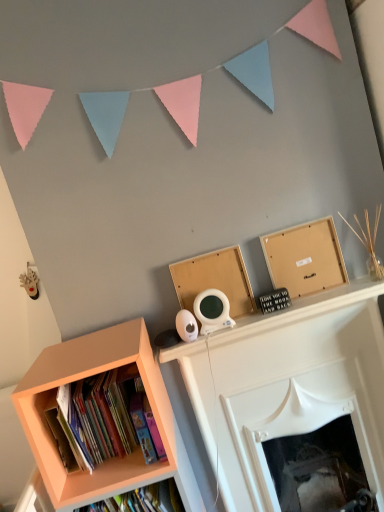
What do you see at coordinates (114, 458) in the screenshot?
I see `matte orange bookcase at lower left` at bounding box center [114, 458].

Measure the distance between matte orange bookshelf at lower left and camera.

matte orange bookshelf at lower left and camera are 1.21 meters apart.

Find the location of a particular element. The height and width of the screenshot is (512, 384). white glossy fireplace at upper center is located at coordinates point(288,386).

Locate an element on the screen. The height and width of the screenshot is (512, 384). wooden frame at upper right is located at coordinates (305, 258).

How much distance is there between matte orange bookcase at lower left and matte orange bookshelf at lower left?

matte orange bookcase at lower left and matte orange bookshelf at lower left are 4.08 inches apart.

From a real-world perspective, is matte orange bookcase at lower left positioned under matte orange bookshelf at lower left based on gravity?

Yes, from a real-world perspective, matte orange bookcase at lower left is under matte orange bookshelf at lower left.

Considering the positions of objects matte orange bookcase at lower left and matte orange bookshelf at lower left in the image provided, who is more to the right, matte orange bookcase at lower left or matte orange bookshelf at lower left?

From the viewer's perspective, matte orange bookcase at lower left appears more on the right side.

Is matte orange bookcase at lower left positioned far away from matte orange bookshelf at lower left?

matte orange bookcase at lower left is near matte orange bookshelf at lower left, not far away.

Would you say matte orange bookshelf at lower left is inside or outside matte orange bookcase at lower left?

matte orange bookshelf at lower left is enclosed within matte orange bookcase at lower left.

How far apart are matte orange bookshelf at lower left and matte orange bookcase at lower left?

The distance of matte orange bookshelf at lower left from matte orange bookcase at lower left is 4.08 inches.

Is the surface of matte orange bookshelf at lower left in direct contact with matte orange bookcase at lower left?

No.

Find the location of a particular element. The height and width of the screenshot is (512, 384). bookcase in front of the matte orange bookshelf at lower left is located at coordinates click(x=114, y=458).

From the image's perspective, is matte orange bookcase at lower left below pastel paper flags at upper center?

Correct, matte orange bookcase at lower left appears lower than pastel paper flags at upper center in the image.

Find the location of a particular element. Image resolution: width=384 pixels, height=512 pixels. backdrop above the matte orange bookcase at lower left (from a real-world perspective) is located at coordinates click(x=177, y=148).

Which of these two, matte orange bookcase at lower left or pastel paper flags at upper center, stands shorter?

pastel paper flags at upper center is shorter.

How distant is matte orange bookcase at lower left from pastel paper flags at upper center?

matte orange bookcase at lower left and pastel paper flags at upper center are 54.93 centimeters apart from each other.

Can you tell me how much white glossy fireplace at upper center and matte orange bookshelf at lower left differ in facing direction?

The angular difference between white glossy fireplace at upper center and matte orange bookshelf at lower left is 0.917 degrees.

Which is in front, point (300, 419) or point (127, 382)?

Point (127, 382)

Is white glossy fireplace at upper center positioned behind matte orange bookshelf at lower left?

Yes, white glossy fireplace at upper center is behind matte orange bookshelf at lower left.

Which of these two, white glossy fireplace at upper center or matte orange bookshelf at lower left, is bigger?

With larger size is white glossy fireplace at upper center.

Is matte orange bookshelf at lower left positioned behind bare wood board at upper center?

No, matte orange bookshelf at lower left is closer to the viewer.

Looking at this image, would you say matte orange bookshelf at lower left is inside or outside bare wood board at upper center?

matte orange bookshelf at lower left is spatially situated outside bare wood board at upper center.

Considering the sizes of objects matte orange bookshelf at lower left and bare wood board at upper center in the image provided, who is smaller, matte orange bookshelf at lower left or bare wood board at upper center?

Smaller between the two is bare wood board at upper center.

From a real-world perspective, is matte orange bookshelf at lower left under bare wood board at upper center?

Yes, from a real-world perspective, matte orange bookshelf at lower left is below bare wood board at upper center.

Does white glossy fireplace at upper center have a lesser width compared to pastel paper flags at upper center?

No.

From the picture: From a real-world perspective, does white glossy fireplace at upper center sit lower than pastel paper flags at upper center?

Correct, in the physical world, white glossy fireplace at upper center is lower than pastel paper flags at upper center.

Considering the points (363, 438) and (61, 322), which point is in front, point (363, 438) or point (61, 322)?

The point (61, 322) is in front.

Is the depth of white glossy fireplace at upper center greater than that of pastel paper flags at upper center?

Yes, white glossy fireplace at upper center is further from the viewer.

From a real-world perspective, is wooden frame at upper right located beneath white glossy fireplace at upper center?

Incorrect, from a real-world perspective, wooden frame at upper right is higher than white glossy fireplace at upper center.

Which is behind, wooden frame at upper right or white glossy fireplace at upper center?

wooden frame at upper right.

Does wooden frame at upper right appear on the right side of white glossy fireplace at upper center?

No.

Does wooden frame at upper right have a lesser width compared to white glossy fireplace at upper center?

A: Yes.

At what (x,y) coordinates should I click in order to perform the action: click on bookcase that is on the right side of matte orange bookshelf at lower left. Please return your answer as a coordinate pair (x, y). The image size is (384, 512). Looking at the image, I should click on (114, 458).

The width and height of the screenshot is (384, 512). Find the location of `book located on the left of matte orange bookcase at lower left`. book located on the left of matte orange bookcase at lower left is located at coordinates (94, 421).

Which object lies further to the anchor point matte orange bookshelf at lower left, matte orange bookcase at lower left or white glossy fireplace at upper center?

Based on the image, white glossy fireplace at upper center appears to be further to matte orange bookshelf at lower left.

Which object lies nearer to the anchor point wooden frame at upper right, pastel paper flags at upper center or matte orange bookcase at lower left?

pastel paper flags at upper center is closer to wooden frame at upper right.

Looking at the image, which one is located closer to white glossy fireplace at upper center, bare wood board at upper center or matte orange bookshelf at lower left?

The object closer to white glossy fireplace at upper center is bare wood board at upper center.

From the image, which object appears to be farther from pastel paper flags at upper center, matte orange bookcase at lower left or matte orange bookshelf at lower left?

matte orange bookshelf at lower left.

When comparing their distances from wooden frame at upper right, does pastel paper flags at upper center or white glossy fireplace at upper center seem further?

Among the two, pastel paper flags at upper center is located further to wooden frame at upper right.

From the picture: Based on their spatial positions, is bare wood board at upper center or white glossy fireplace at upper center further from pastel paper flags at upper center?

white glossy fireplace at upper center lies further to pastel paper flags at upper center than the other object.

Considering their positions, is white glossy fireplace at upper center positioned closer to matte orange bookcase at lower left than bare wood board at upper center?

white glossy fireplace at upper center is positioned closer to the anchor matte orange bookcase at lower left.

Considering their positions, is white glossy fireplace at upper center positioned closer to matte orange bookcase at lower left than wooden frame at upper right?

white glossy fireplace at upper center lies closer to matte orange bookcase at lower left than the other object.

You are a GUI agent. You are given a task and a screenshot of the screen. Output one action in this format:
    pyautogui.click(x=<x>, y=<y>)
    Task: Click on the cardboard box that lies between pastel paper flags at upper center and white glossy fireplace at upper center from top to bottom
    
    Given the screenshot: What is the action you would take?
    pyautogui.click(x=215, y=279)

I want to click on cardboard box that lies between pastel paper flags at upper center and matte orange bookcase at lower left from top to bottom, so click(x=215, y=279).

Where is `shelf between matte orange bookshelf at lower left and white glossy fireplace at upper center in the horizontal direction`? This screenshot has height=512, width=384. shelf between matte orange bookshelf at lower left and white glossy fireplace at upper center in the horizontal direction is located at coordinates (305, 258).

In order to click on shelf that lies between pastel paper flags at upper center and bare wood board at upper center from top to bottom in this screenshot , I will do `click(305, 258)`.